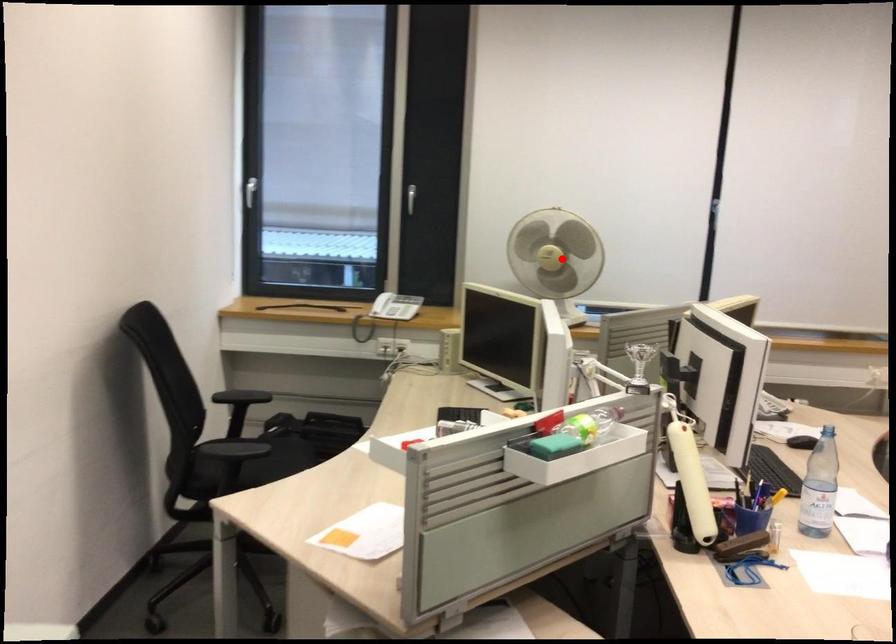
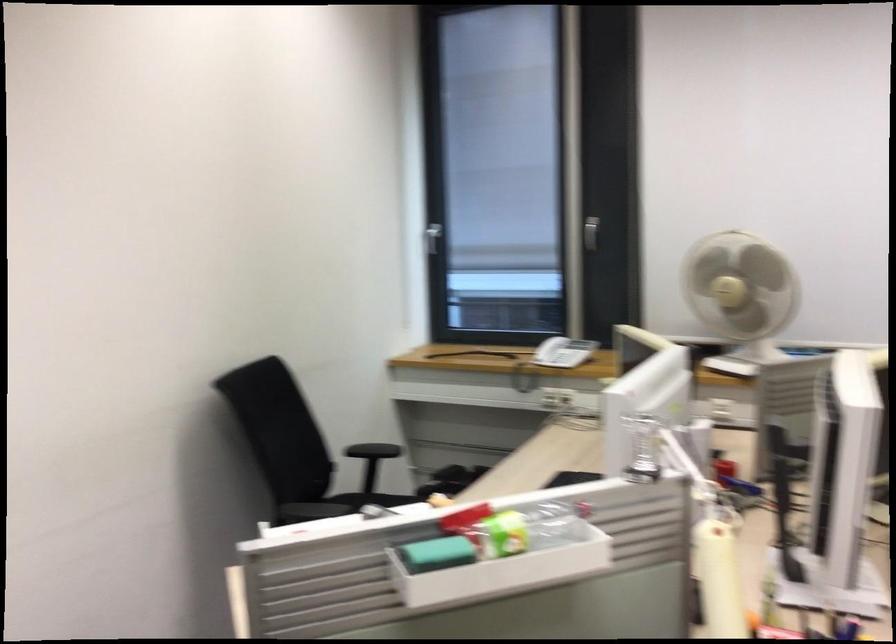
The point at the highlighted location is marked in the first image. Where is the corresponding point in the second image?

(741, 290)